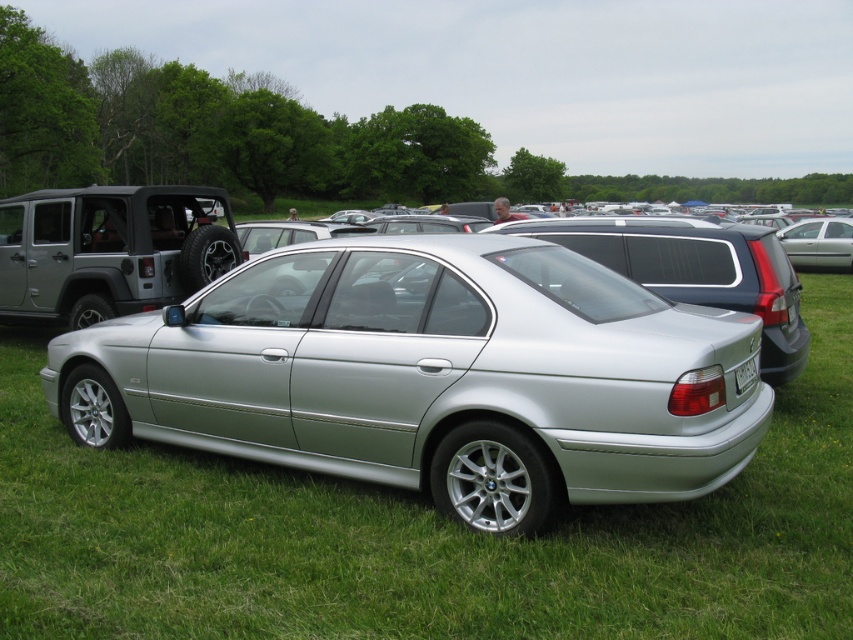
You are a photographer trying to capture the silver metallic sedan at center and the white plastic license plate at rear in the same frame. Since the sedan is much taller than the license plate, how should you adjust your camera angle to ensure both are visible in the shot?

Since the silver metallic sedan at center is much taller than the white plastic license plate at rear, you should lower your camera angle to capture both the full height of the sedan and the license plate positioned lower on the rear.

You are a parking assistant trying to fit the silver metallic sedan at center into a parking spot that is exactly the width of the white plastic license plate at rear. Can the sedan fit without overlapping the lines?

The silver metallic sedan at center is wider than the white plastic license plate at rear, so it cannot fit into the parking spot without overlapping the lines.

You are a photographer setting up a shot of the matte silver suv at left and the white plastic license plate at rear. Based on their heights, which object should you focus on first if you want to capture both in a single frame without adjusting your camera angle?

The matte silver suv at left is taller than the white plastic license plate at rear, so you should focus on the matte silver suv at left first to ensure both are in frame without adjusting the camera angle.